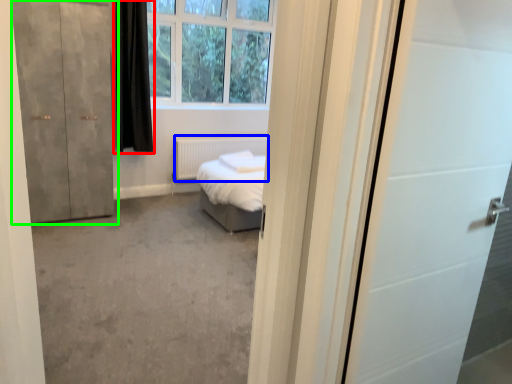
Question: Which object is positioned farthest from curtain (highlighted by a red box)? Select from radiator (highlighted by a blue box) and door (highlighted by a green box).

Choices:
 (A) radiator
 (B) door

Answer: (A)